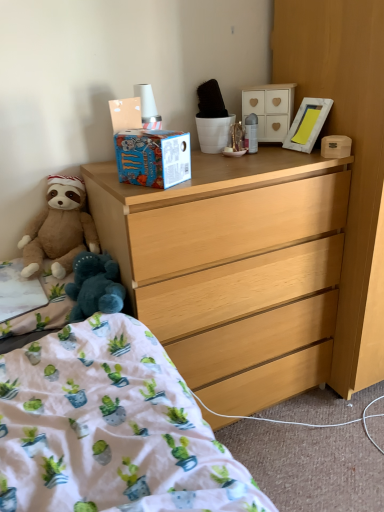
Find the location of `unoccupied area in front of white matte cabinet at upper center, marked as the first cabinetry in a left-to-right arrangement`. unoccupied area in front of white matte cabinet at upper center, marked as the first cabinetry in a left-to-right arrangement is located at coordinates (272, 156).